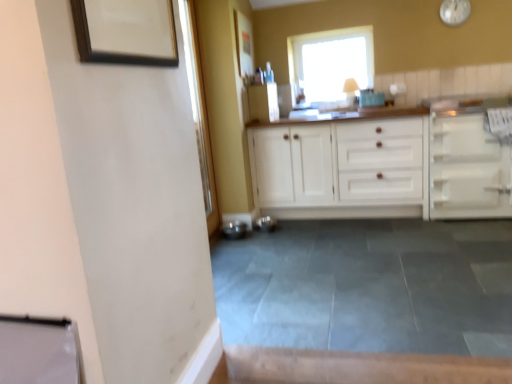
Question: Considering the relative positions of matte wooden picture frame at upper center, which is the first picture frame from back to front, and white glossy clock at upper right in the image provided, is matte wooden picture frame at upper center, which is the first picture frame from back to front, in front of white glossy clock at upper right?

Choices:
 (A) yes
 (B) no

Answer: (A)

Question: From the image's perspective, does matte wooden picture frame at upper center, the second picture frame from the left, appear lower than white glossy clock at upper right?

Choices:
 (A) yes
 (B) no

Answer: (A)

Question: Does matte wooden picture frame at upper center, arranged as the 1th picture frame when viewed from the top, have a greater width compared to white glossy clock at upper right?

Choices:
 (A) yes
 (B) no

Answer: (A)

Question: Can you confirm if matte wooden picture frame at upper center, arranged as the 1th picture frame when viewed from the top, is bigger than white glossy clock at upper right?

Choices:
 (A) no
 (B) yes

Answer: (B)

Question: Considering the relative sizes of matte wooden picture frame at upper center, arranged as the 1th picture frame when viewed from the top, and white glossy clock at upper right in the image provided, is matte wooden picture frame at upper center, arranged as the 1th picture frame when viewed from the top, shorter than white glossy clock at upper right?

Choices:
 (A) no
 (B) yes

Answer: (A)

Question: In the image, is white wood cabinet at center, positioned as the second cabinetry in right-to-left order, positioned in front of or behind white matte cabinet at right, which is the 2th cabinetry in left-to-right order?

Choices:
 (A) behind
 (B) front

Answer: (A)

Question: From a real-world perspective, relative to white matte cabinet at right, the 1th cabinetry from the right, is white wood cabinet at center, positioned as the second cabinetry in right-to-left order, vertically above or below?

Choices:
 (A) below
 (B) above

Answer: (B)

Question: From the image's perspective, is white wood cabinet at center, which is the first cabinetry from left to right, located above or below white matte cabinet at right, which is the 2th cabinetry in left-to-right order?

Choices:
 (A) below
 (B) above

Answer: (A)

Question: From their relative heights in the image, would you say white wood cabinet at center, positioned as the second cabinetry in right-to-left order, is taller or shorter than white matte cabinet at right, the 1th cabinetry from the right?

Choices:
 (A) tall
 (B) short

Answer: (A)

Question: From the image's perspective, relative to white glossy clock at upper right, is matte wooden picture frame at upper center, placed as the second picture frame when sorted from front to back, above or below?

Choices:
 (A) below
 (B) above

Answer: (A)

Question: Is matte wooden picture frame at upper center, arranged as the 1th picture frame when viewed from the top, taller or shorter than white glossy clock at upper right?

Choices:
 (A) short
 (B) tall

Answer: (B)

Question: Looking at their shapes, would you say matte wooden picture frame at upper center, which is the first picture frame from back to front, is wider or thinner than white glossy clock at upper right?

Choices:
 (A) thin
 (B) wide

Answer: (B)

Question: Does point (252, 64) appear closer or farther from the camera than point (460, 1)?

Choices:
 (A) farther
 (B) closer

Answer: (A)

Question: From the image's perspective, relative to white wood cabinet at center, which is the first cabinetry from left to right, is white glossy clock at upper right above or below?

Choices:
 (A) below
 (B) above

Answer: (B)

Question: Considering the positions of white glossy clock at upper right and white wood cabinet at center, positioned as the second cabinetry in right-to-left order, in the image, is white glossy clock at upper right bigger or smaller than white wood cabinet at center, positioned as the second cabinetry in right-to-left order,?

Choices:
 (A) big
 (B) small

Answer: (B)